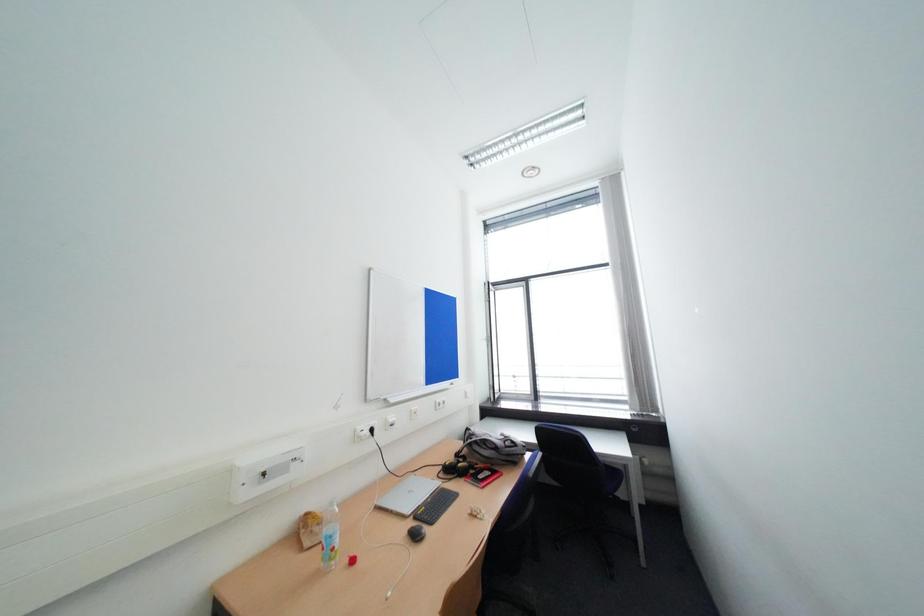
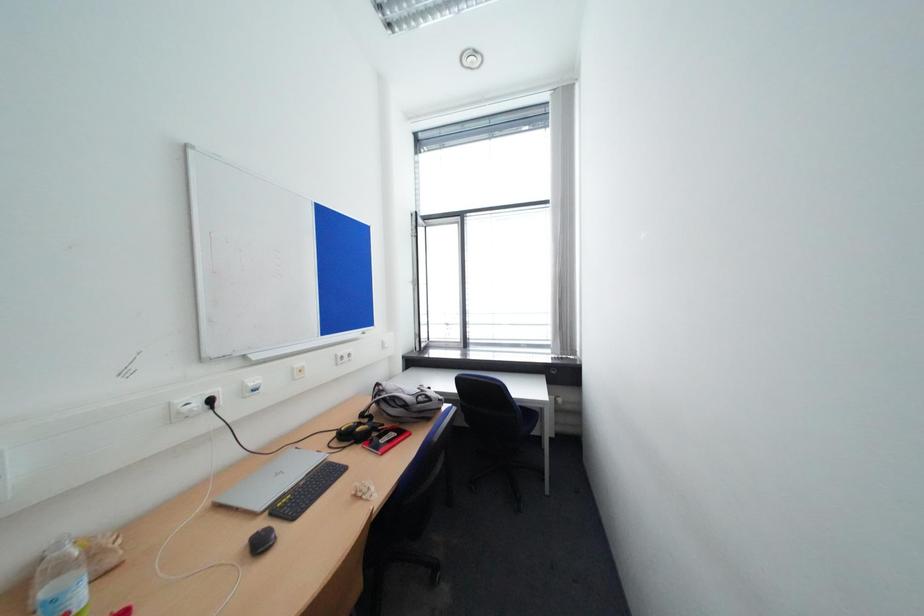
Question: The camera is either moving clockwise (left) or counter-clockwise (right) around the object. The first image is from the beginning of the video and the second image is from the end. Is the camera moving left or right when shooting the video?

Choices:
 (A) Left
 (B) Right

Answer: (A)